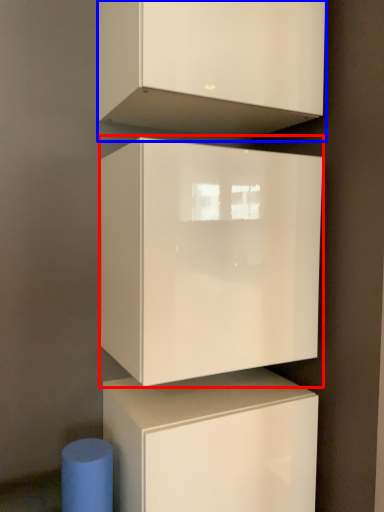
Question: Which of the following is the closest to the observer, cabinetry (highlighted by a red box) or cabinetry (highlighted by a blue box)?

Choices:
 (A) cabinetry
 (B) cabinetry

Answer: (B)